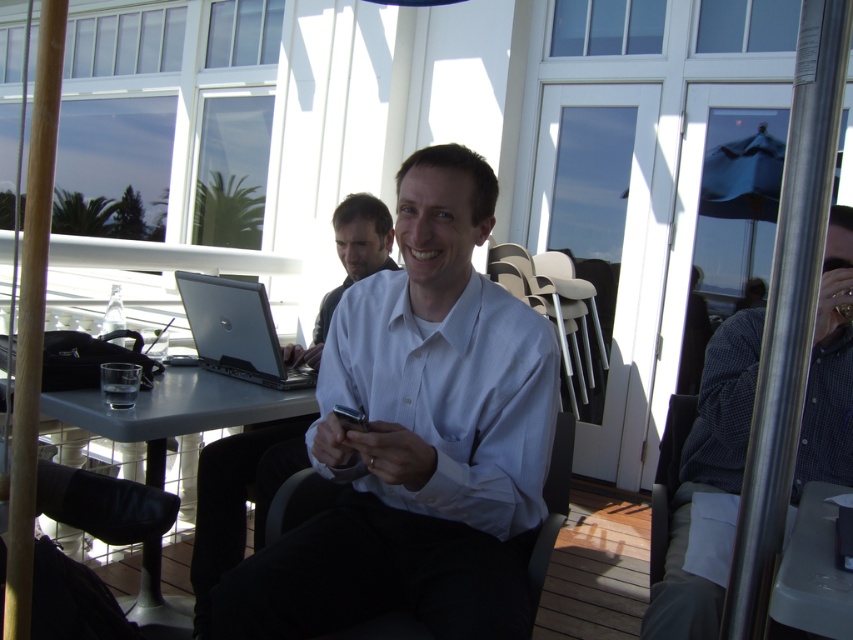
You are standing at the entrance of the cafe and want to sit at the gray plastic table at center. Which direction should you walk to reach it?

Since the gray plastic table at center is located at point 0.642 on the x and 0.208 on the y coordinates, you should walk towards the center of the cafe to reach it.